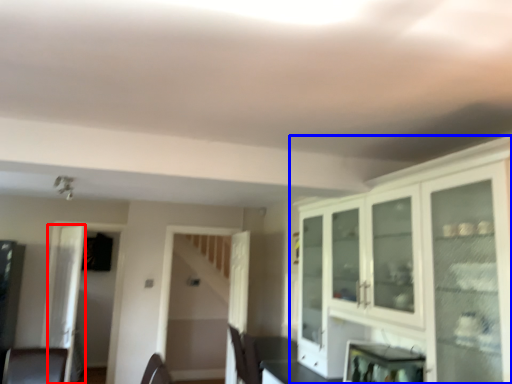
Question: Which point is closer to the camera, glass door (highlighted by a red box) or cabinetry (highlighted by a blue box)?

Choices:
 (A) glass door
 (B) cabinetry

Answer: (B)